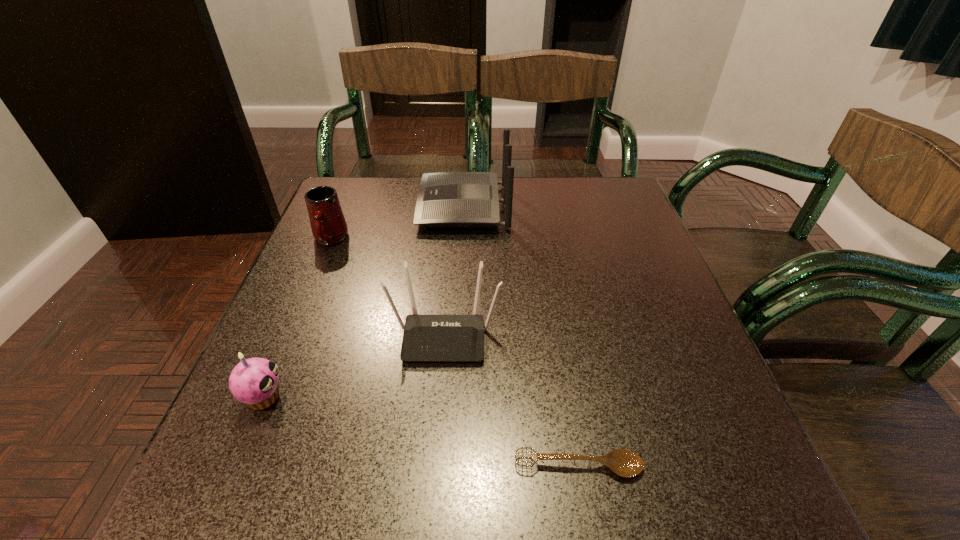
In the image, there is a desktop. Find the location of `vacant space at the left edge`. vacant space at the left edge is located at coordinates (349, 228).

At what (x,y) coordinates should I click in order to perform the action: click on free space at the right edge. Please return your answer as a coordinate pair (x, y). Looking at the image, I should click on (660, 395).

Locate an element on the screen. This screenshot has height=540, width=960. vacant space at the far left corner is located at coordinates (371, 188).

Find the location of `vacant area at the near left corner`. vacant area at the near left corner is located at coordinates (206, 492).

In the image, there is a desktop. Where is `vacant space at the far right corner`? vacant space at the far right corner is located at coordinates (622, 188).

You are a GUI agent. You are given a task and a screenshot of the screen. Output one action in this format:
    pyautogui.click(x=<x>, y=<y>)
    Task: Click on the vacant space at the near right corner
    The height and width of the screenshot is (540, 960).
    Given the screenshot: What is the action you would take?
    pyautogui.click(x=670, y=482)

At what (x,y) coordinates should I click in order to perform the action: click on unoccupied position between the tallest object and the nearer router. Please return your answer as a coordinate pair (x, y). The height and width of the screenshot is (540, 960). Looking at the image, I should click on (454, 271).

Locate an element on the screen. empty space that is in between the cupcake and the ladle is located at coordinates (421, 431).

Where is `free space that is in between the mug and the second nearest object`? The width and height of the screenshot is (960, 540). free space that is in between the mug and the second nearest object is located at coordinates (297, 318).

You are a GUI agent. You are given a task and a screenshot of the screen. Output one action in this format:
    pyautogui.click(x=<x>, y=<y>)
    Task: Click on the free area in between the third nearest object and the cupcake
    
    Given the screenshot: What is the action you would take?
    pyautogui.click(x=354, y=366)